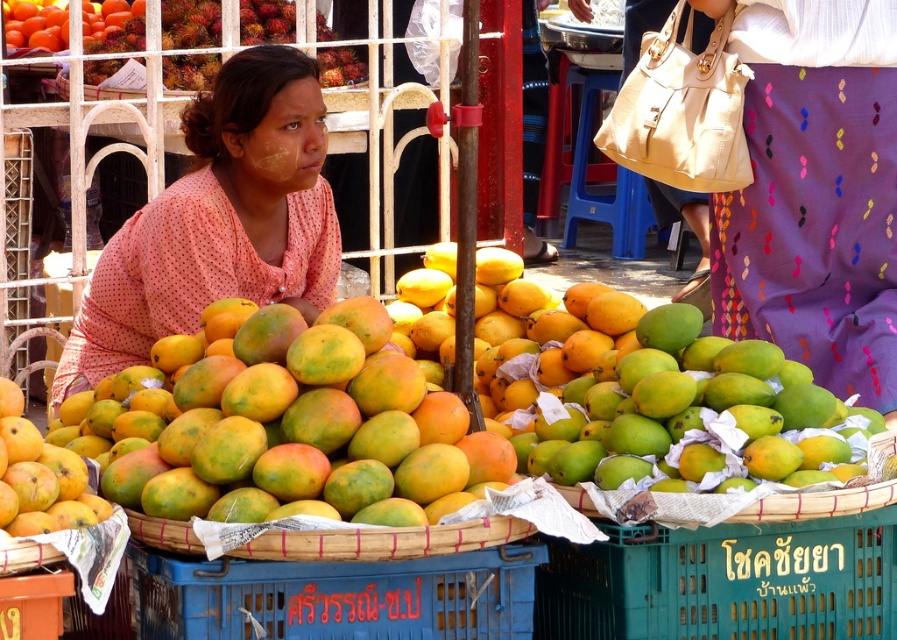
Question: Which of the following is the closest to the observer?

Choices:
 (A) (170, 296)
 (B) (18, 452)
 (C) (285, 38)

Answer: (B)

Question: Is green matte mangoes at center to the right of blue plastic crate at lower center from the viewer's perspective?

Choices:
 (A) no
 (B) yes

Answer: (B)

Question: Is blue plastic crate at lower center smaller than yellow matte mango at center?

Choices:
 (A) no
 (B) yes

Answer: (A)

Question: Considering the relative positions of green matte mango at center and yellow matte mango at center in the image provided, where is green matte mango at center located with respect to yellow matte mango at center?

Choices:
 (A) right
 (B) left

Answer: (A)

Question: Which point is farther to the camera?

Choices:
 (A) 141,404
 (B) 114,371
 (C) 414,563
 (D) 22,468

Answer: (B)

Question: Which object is positioned closest to the green matte mangoes at center?

Choices:
 (A) ruddy textured rambutan at upper center
 (B) yellow matte mango at center
 (C) pink dotted blouse at center

Answer: (C)